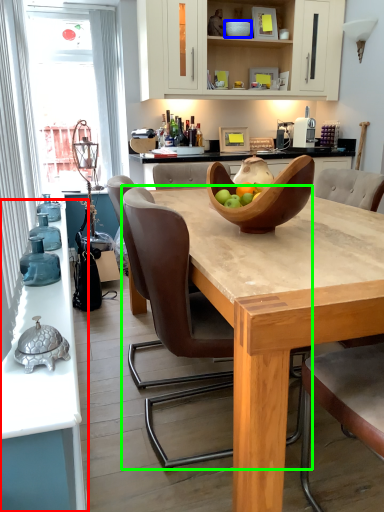
Question: Considering the real-world distances, which object is farthest from countertop (highlighted by a red box)? bowl (highlighted by a blue box) or chair (highlighted by a green box)?

Choices:
 (A) bowl
 (B) chair

Answer: (A)